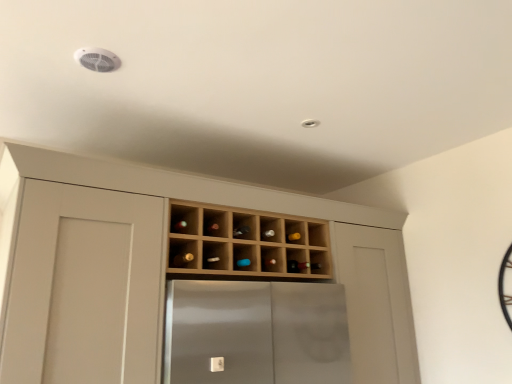
Question: From the image's perspective, is matte brown wine bottle at center, positioned as the 2th wine bottle in right-to-left order, above or below wooden wine rack at center?

Choices:
 (A) above
 (B) below

Answer: (B)

Question: Choose the correct answer: Is matte brown wine bottle at center, the second wine bottle when ordered from bottom to top, inside wooden wine rack at center or outside it?

Choices:
 (A) inside
 (B) outside

Answer: (A)

Question: Estimate the real-world distances between objects in this image. Which object is farther from the matte brown wine bottle at center, placed as the 1th wine bottle when sorted from front to back?

Choices:
 (A) light wood wine rack at center
 (B) translucent glass wine bottle at center, the 1th wine bottle positioned from the right
 (C) wooden wine rack at center

Answer: (A)

Question: Which of these objects is positioned closest to the wooden wine rack at center?

Choices:
 (A) matte brown wine bottle at center, the first wine bottle in the top-to-bottom sequence
 (B) translucent glass wine bottle at center, arranged as the 2th wine bottle when viewed from the left
 (C) light wood wine rack at center

Answer: (C)